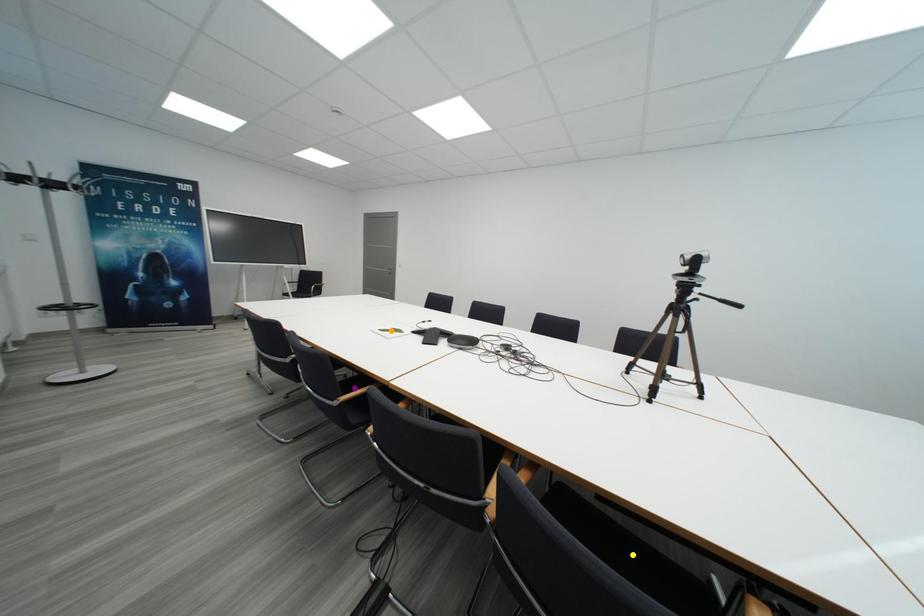
Order these from farthest to nearest:
1. orange point
2. purple point
3. yellow point

orange point
purple point
yellow point